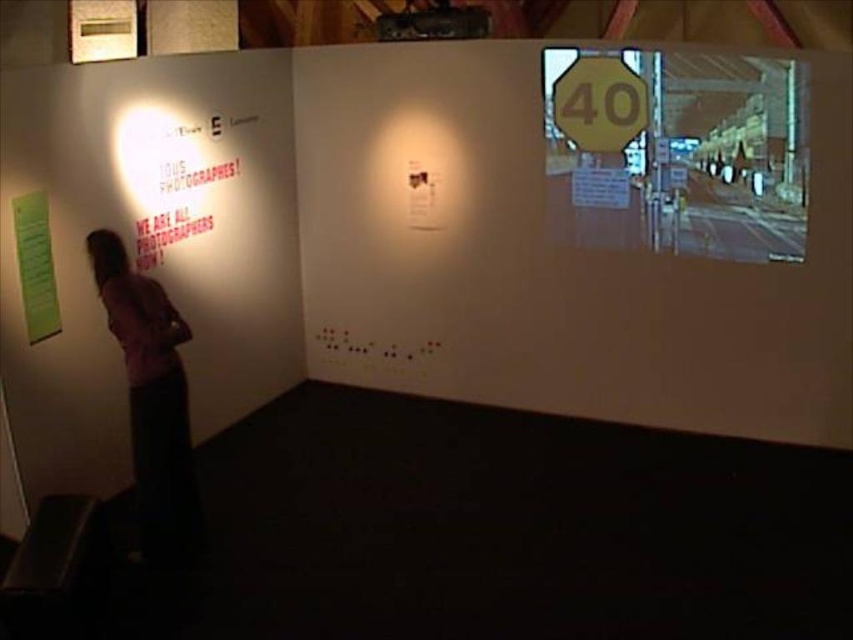
Question: Is yellow reflective sign at upper right below green paper at left?

Choices:
 (A) no
 (B) yes

Answer: (A)

Question: Estimate the real-world distances between objects in this image. Which object is closer to the green paper at left?

Choices:
 (A) yellow matte sign at upper right
 (B) pink fabric at left
 (C) yellow reflective sign at upper right

Answer: (B)

Question: Does pink fabric at left appear on the left side of green paper at left?

Choices:
 (A) no
 (B) yes

Answer: (A)

Question: Which object appears farthest from the camera in this image?

Choices:
 (A) green paper at left
 (B) yellow matte sign at upper right
 (C) yellow reflective sign at upper right
 (D) pink fabric at left

Answer: (B)

Question: Does pink fabric at left lie behind yellow matte sign at upper right?

Choices:
 (A) yes
 (B) no

Answer: (B)

Question: Among these objects, which one is nearest to the camera?

Choices:
 (A) yellow reflective sign at upper right
 (B) green paper at left
 (C) yellow matte sign at upper right
 (D) pink fabric at left

Answer: (D)